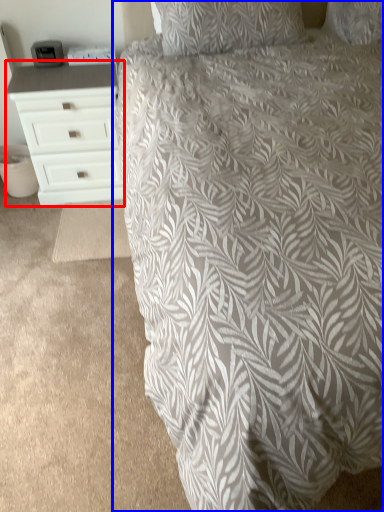
Question: Among these objects, which one is farthest to the camera, chest of drawers (highlighted by a red box) or bed (highlighted by a blue box)?

Choices:
 (A) chest of drawers
 (B) bed

Answer: (A)